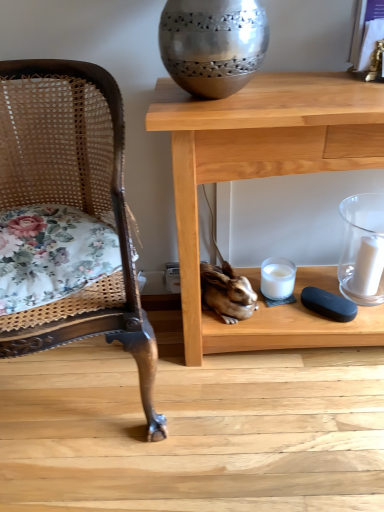
Locate an element on the screen. This screenshot has height=512, width=384. vacant space situated above wooden table at center (from a real-world perspective) is located at coordinates (285, 93).